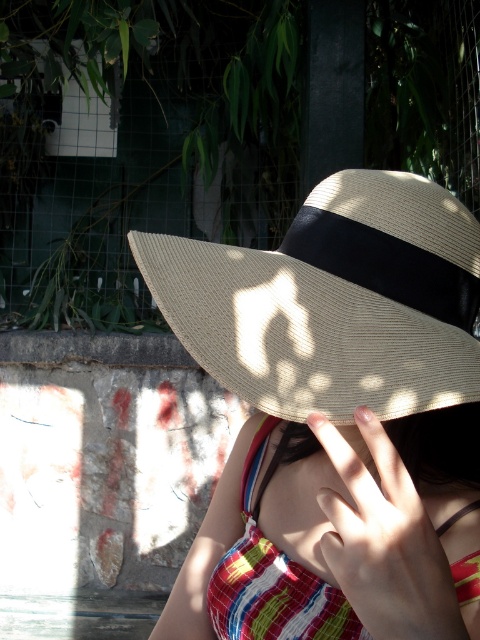
From the picture: You are a fashion designer observing the image. You need to determine which item is closer to the camera between the natural straw hat at center and the striped fabric bikini top at center. Which one is closer?

The natural straw hat at center is shorter than the striped fabric bikini top at center, so the natural straw hat at center is closer to the camera.

You are a photographer trying to capture the subject without including the wire mesh fence in the background. Given the positioning of the natural straw hat at center and the striped fabric bikini top at center, which object should you focus on to ensure the fence is out of frame?

The natural straw hat at center is wider than the striped fabric bikini top at center. To avoid including the wire mesh fence in the background, focus on the natural straw hat at center as it has a larger width, allowing you to frame the shot around its broader silhouette while keeping the fence out of view.

You are a photographer trying to capture the exact center of the image. You notice the point at coordinates (334, 301). What object is located there?

The natural straw hat at center is located at point (334, 301).